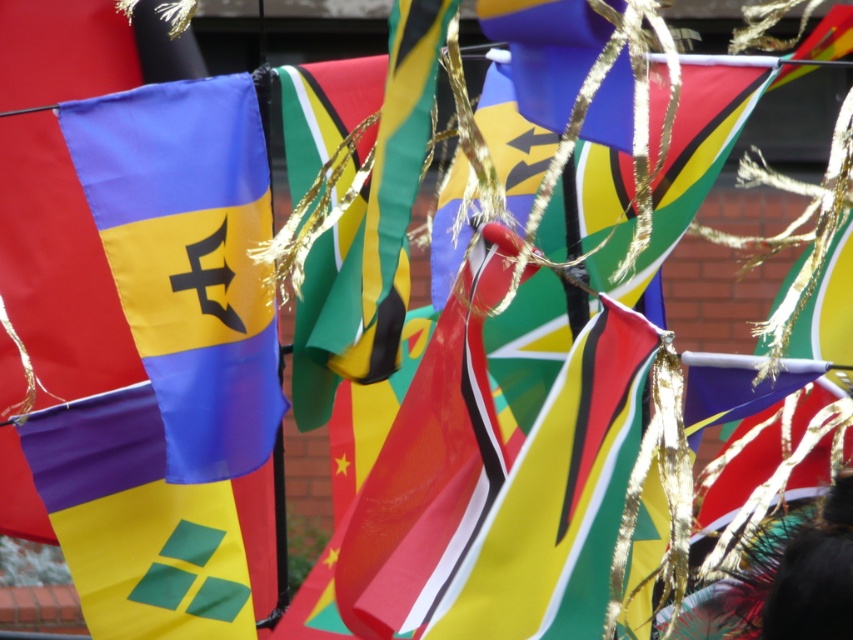
Question: Is matte blue flag at left wider than matte fabric flag at lower left?

Choices:
 (A) yes
 (B) no

Answer: (B)

Question: Does matte blue flag at left appear on the right side of matte fabric flag at lower left?

Choices:
 (A) no
 (B) yes

Answer: (B)

Question: Which point is farther from the camera taking this photo?

Choices:
 (A) (189, 120)
 (B) (119, 436)

Answer: (B)

Question: Which point is farther to the camera?

Choices:
 (A) (126, 294)
 (B) (146, 493)

Answer: (B)

Question: Observing the image, what is the correct spatial positioning of matte blue flag at left in reference to matte fabric flag at lower left?

Choices:
 (A) right
 (B) left

Answer: (A)

Question: Which point is farther from the camera taking this photo?

Choices:
 (A) (144, 266)
 (B) (103, 451)

Answer: (B)